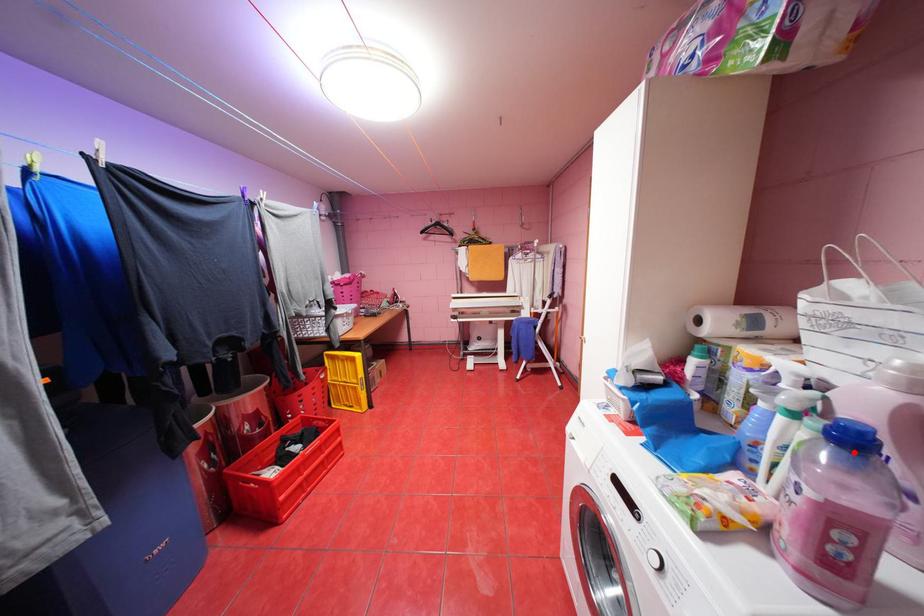
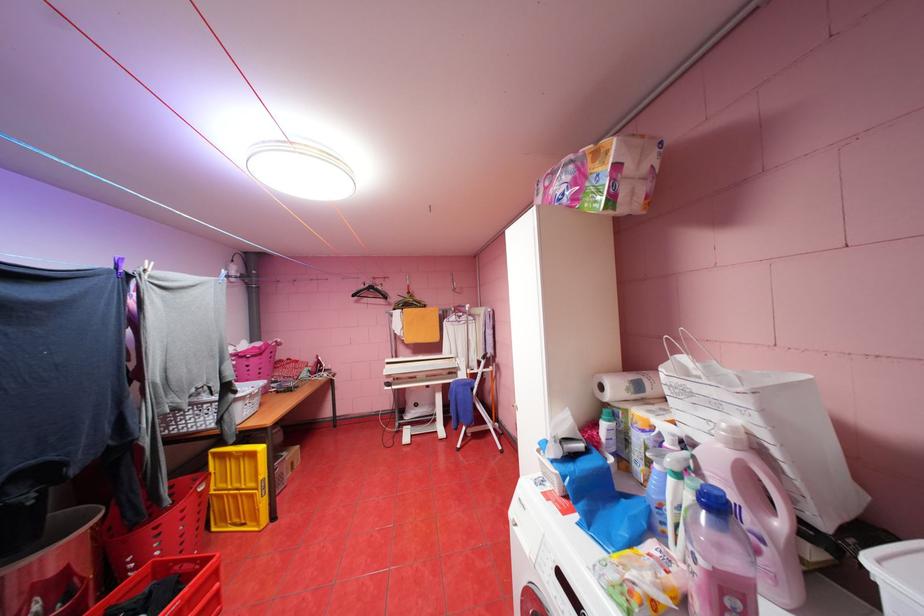
Locate, in the second image, the point that corresponds to the highlighted location in the first image.

(723, 517)